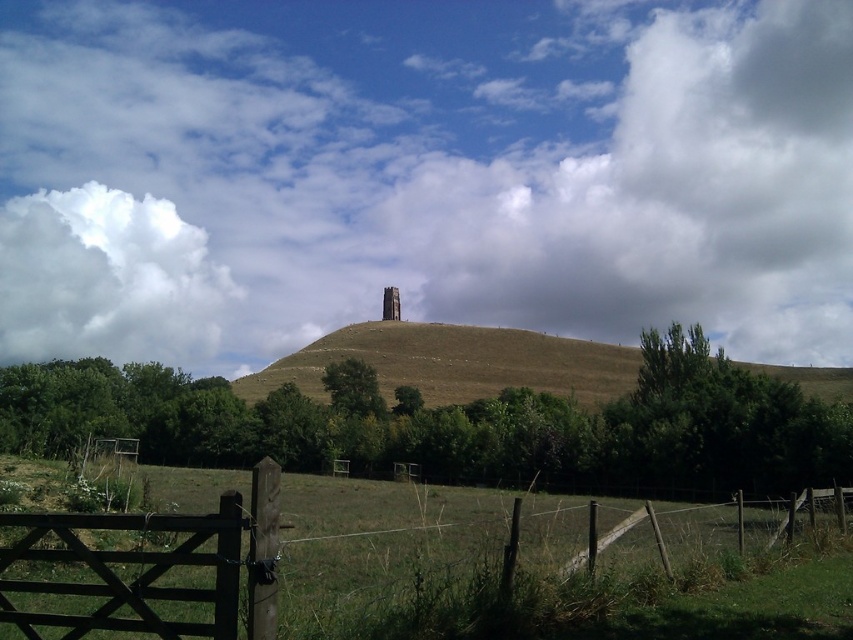
Question: Which object appears farthest from the camera in this image?

Choices:
 (A) white fluffy cloud at upper center
 (B) stone tower at center
 (C) green grassy field at lower center

Answer: (A)

Question: Which of the following is the closest to the observer?

Choices:
 (A) green grassy field at lower center
 (B) stone tower at center
 (C) white fluffy cloud at upper center

Answer: (A)

Question: Which object is the farthest from the brown grassy hill at center?

Choices:
 (A) green grassy field at lower center
 (B) white fluffy cloud at upper center
 (C) white fluffy cloud at upper left

Answer: (C)

Question: In this image, where is white fluffy cloud at upper center located relative to stone tower at center?

Choices:
 (A) above
 (B) below

Answer: (A)

Question: Is the position of brown grassy hill at center more distant than that of wooden gate at lower left?

Choices:
 (A) yes
 (B) no

Answer: (A)

Question: Does white fluffy cloud at upper center appear under white fluffy cloud at upper left?

Choices:
 (A) yes
 (B) no

Answer: (B)